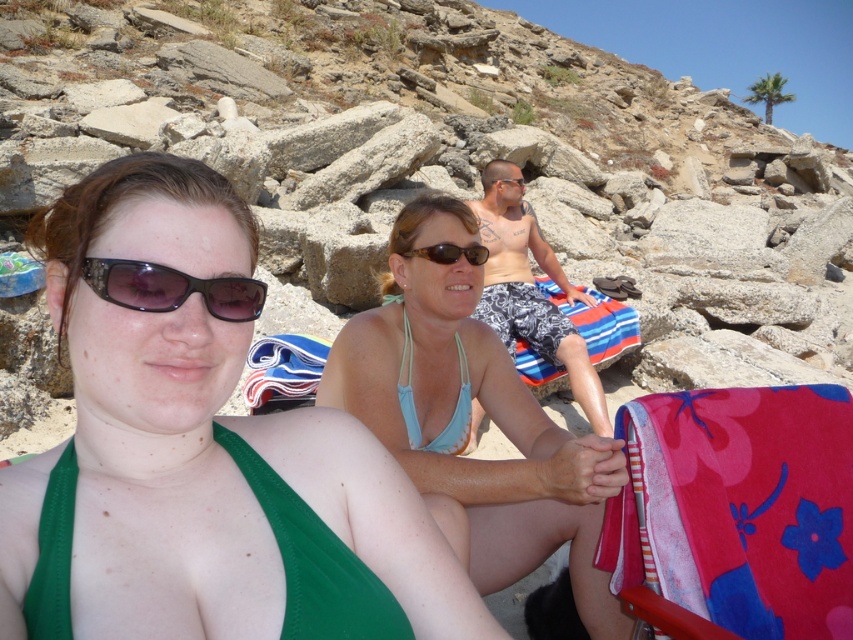
What are the coordinates of the green fabric bikini top at center in the image?

The coordinates of the green fabric bikini top at center are at point (201, 451).

You are a photographer trying to capture the perfect shot of the black textured sunglasses at center. Based on their position in the scene, which direction should you move to frame them better?

The black textured sunglasses at center are located at coordinates point (171,289). To frame them better, you should move slightly to the left and down since the coordinates indicate they are positioned slightly off the center of the image.

You are a photographer trying to capture a photo of the rocky at upper center and the black textured sunglasses at center. Which object should you focus on first if you want to ensure both are in the frame without moving the camera?

You should focus on the black textured sunglasses at center first because it is closer to the camera than the rocky at upper center, which is further away. By focusing on the closer object, the rocky at upper center will also be in focus if they are within the same depth of field.